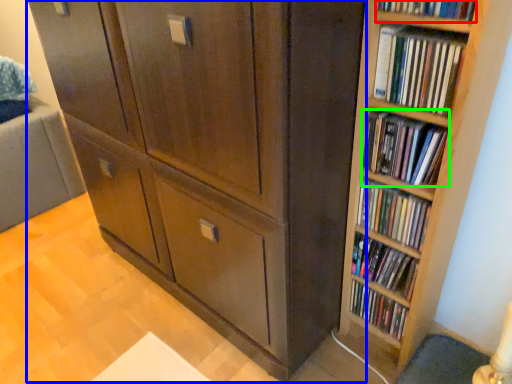
Question: Based on their relative distances, which object is farther from book (highlighted by a red box)? Choose from cupboard (highlighted by a blue box) and book (highlighted by a green box).

Choices:
 (A) cupboard
 (B) book

Answer: (A)